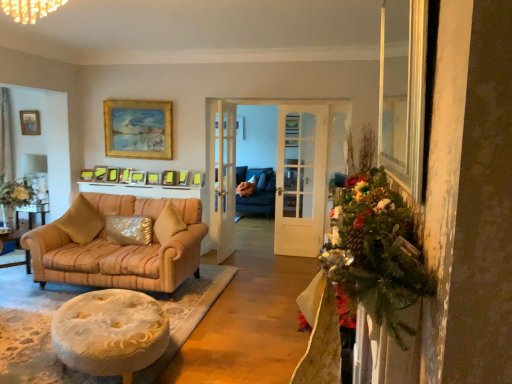
Question: From a real-world perspective, is matte gold picture frame at center, the seventh picture frame when ordered from left to right, positioned above or below white glossy lampshade at upper left?

Choices:
 (A) below
 (B) above

Answer: (B)

Question: From the image's perspective, is matte gold picture frame at center, the fourth picture frame from the right, positioned above or below white glossy lampshade at upper left?

Choices:
 (A) below
 (B) above

Answer: (B)

Question: Estimate the real-world distances between objects in this image. Which object is closer to the matte gold picture frame at center, the 2th picture frame from the left?

Choices:
 (A) white glossy lampshade at upper left
 (B) matte gold picture frame at center, the fourth picture frame from the right
 (C) matte gold picture frame at center, acting as the 6th picture frame starting from the right
 (D) sparkly gold pillow at center, the first pillow when ordered from right to left
 (E) gold-framed picture at upper center, marked as the 9th picture frame in a left-to-right arrangement

Answer: (C)

Question: Considering the real-world distances, which object is farthest from the matte gold picture frame at upper center, which is counted as the 7th picture frame, starting from the right?

Choices:
 (A) white glossy lampshade at upper left
 (B) sparkly gold pillow at center, the first pillow when ordered from right to left
 (C) matte gold picture frame at center, the fifth picture frame in the left-to-right sequence
 (D) matte gold picture frame at center, the tenth picture frame from the left
 (E) matte gold picture frame at center, which is the 9th picture frame from right to left

Answer: (B)